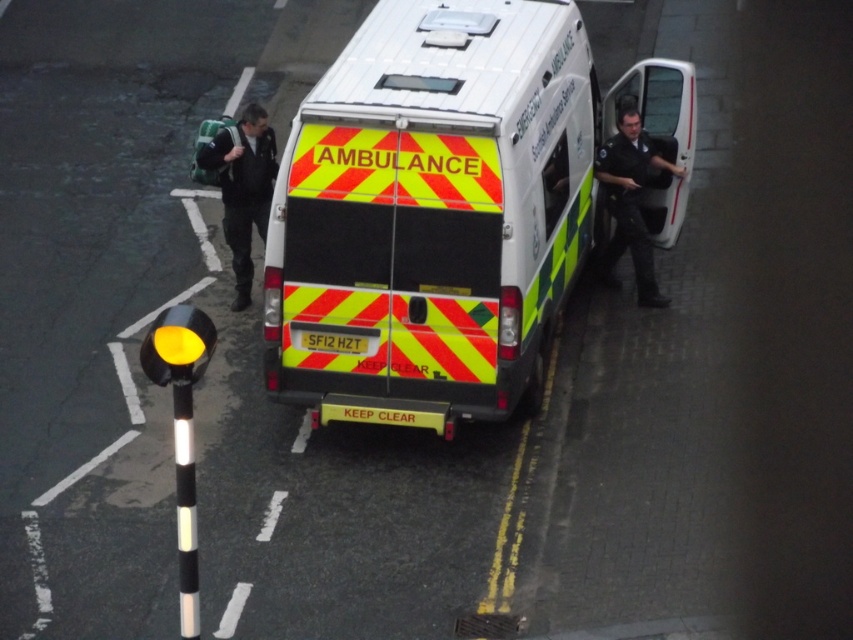
You are a delivery person standing next to the white glossy ambulance at center with a package that needs to be placed exactly 3 meters away from the ambulance. You see the dark green backpack at upper left. Is the backpack within the required distance for placing the package?

The white glossy ambulance at center and dark green backpack at upper left are 2.52 meters apart, so the backpack is within the required 3 meters distance for placing the package.

You are standing in front of the ambulance and see two points marked on its side. The first point is at coordinate point (x=263, y=205) and the second is at point (x=602, y=148). Which point is closer to you?

Point (x=263, y=205) is further to the camera than point (x=602, y=148), so the closer point to you is point (x=602, y=148).